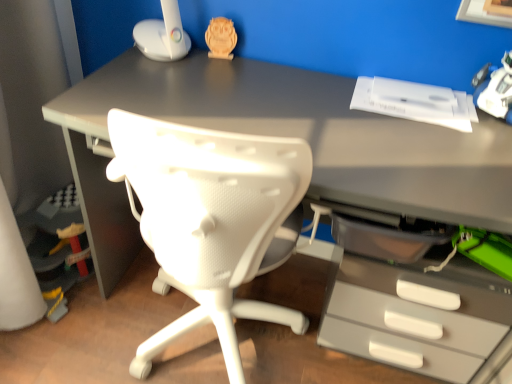
I want to click on free point to the right of wooden owl at upper center, which is counted as the second toy, starting from the right, so click(272, 71).